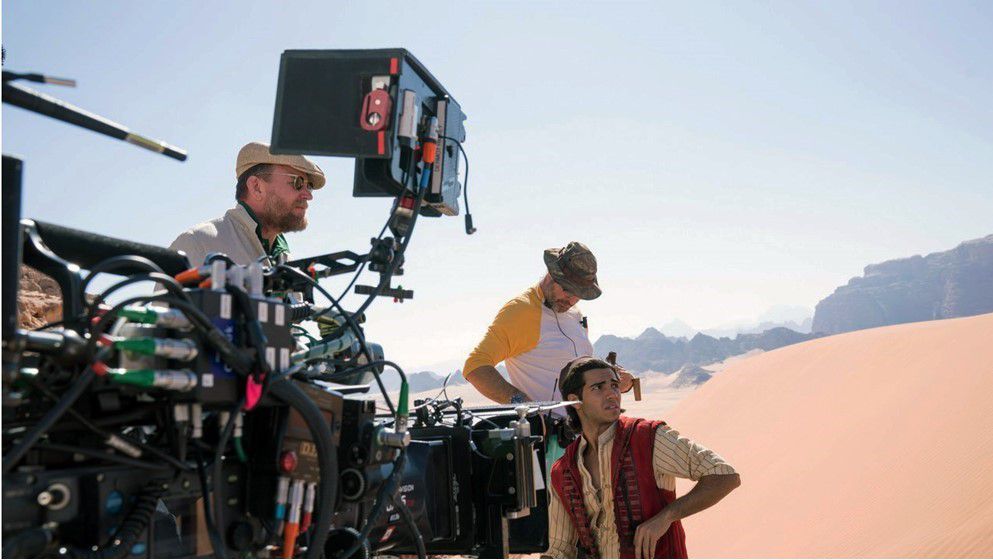
Find the location of a particular element. electronic equipment is located at coordinates (378, 124).